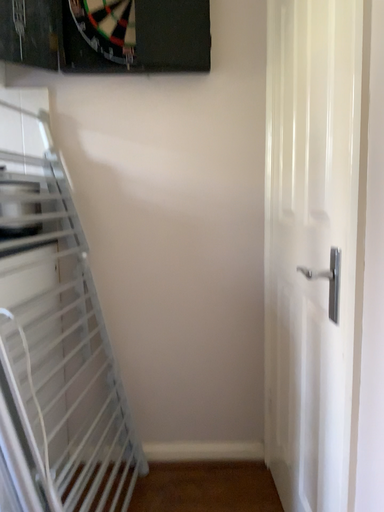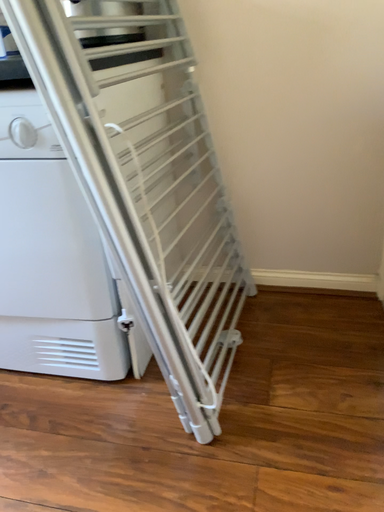
Question: How did the camera likely rotate when shooting the video?

Choices:
 (A) rotated upward
 (B) rotated downward

Answer: (B)